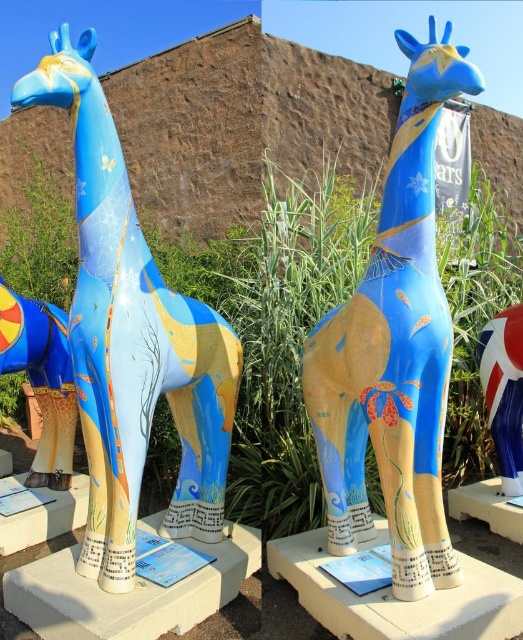
Who is positioned more to the right, matte blue giraffe at center or matte yellow giraffe at left?

From the viewer's perspective, matte blue giraffe at center appears more on the right side.

Between matte blue giraffe at center and matte yellow giraffe at left, which one is positioned higher?

matte blue giraffe at center is above.

The width and height of the screenshot is (523, 640). Describe the element at coordinates (132, 339) in the screenshot. I see `matte blue giraffe at center` at that location.

Find the location of a particular element. Image resolution: width=523 pixels, height=640 pixels. matte blue giraffe at center is located at coordinates (132, 339).

From the picture: Is matte blue giraffe at center bigger than matte painted giraffe at center?

Indeed, matte blue giraffe at center has a larger size compared to matte painted giraffe at center.

Can you confirm if matte blue giraffe at center is positioned below matte painted giraffe at center?

Yes.

Which is behind, point (234, 378) or point (346, 390)?

The point (234, 378) is behind.

Identify the location of matte blue giraffe at center. Image resolution: width=523 pixels, height=640 pixels. (132, 339).

Between matte painted giraffe at center and matte yellow giraffe at left, which one has more height?

matte painted giraffe at center

Does matte painted giraffe at center have a lesser height compared to matte yellow giraffe at left?

No.

The width and height of the screenshot is (523, 640). I want to click on matte painted giraffe at center, so click(x=394, y=348).